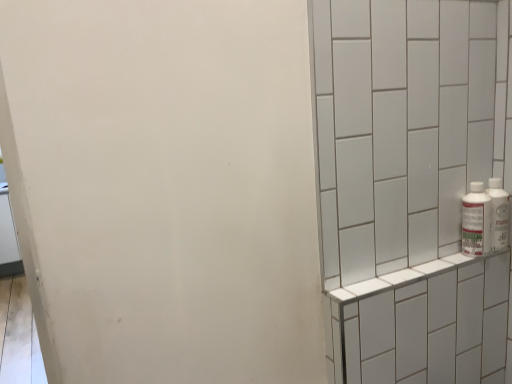
Question: Is white plastic bottle at right, the 2th bottle from the right, at the right side of white tile shelf at right?

Choices:
 (A) yes
 (B) no

Answer: (A)

Question: From a real-world perspective, is white plastic bottle at right, the first bottle from the left, physically above white tile shelf at right?

Choices:
 (A) no
 (B) yes

Answer: (B)

Question: Can you confirm if white plastic bottle at right, the first bottle from the left, is shorter than white tile shelf at right?

Choices:
 (A) no
 (B) yes

Answer: (B)

Question: Could you tell me if white plastic bottle at right, the first bottle from the left, is facing white tile shelf at right?

Choices:
 (A) yes
 (B) no

Answer: (B)

Question: Is white plastic bottle at right, the 2th bottle from the right, smaller than white tile shelf at right?

Choices:
 (A) no
 (B) yes

Answer: (B)

Question: From a real-world perspective, is white tile shelf at right positioned above or below white plastic bottle at right, the first bottle from the left?

Choices:
 (A) below
 (B) above

Answer: (A)

Question: Relative to white plastic bottle at right, the first bottle from the left, is white tile shelf at right in front or behind?

Choices:
 (A) front
 (B) behind

Answer: (A)

Question: Considering the positions of white tile shelf at right and white plastic bottle at right, the 2th bottle from the right, in the image, is white tile shelf at right bigger or smaller than white plastic bottle at right, the 2th bottle from the right,?

Choices:
 (A) big
 (B) small

Answer: (A)

Question: Considering the positions of white tile shelf at right and white plastic bottle at right, the first bottle from the left, in the image, is white tile shelf at right taller or shorter than white plastic bottle at right, the first bottle from the left,?

Choices:
 (A) short
 (B) tall

Answer: (B)

Question: Considering the positions of white tile shelf at right and white plastic bottles at right, which is counted as the second bottle, starting from the left, in the image, is white tile shelf at right taller or shorter than white plastic bottles at right, which is counted as the second bottle, starting from the left,?

Choices:
 (A) tall
 (B) short

Answer: (A)

Question: Considering their positions, is white tile shelf at right located in front of or behind white plastic bottles at right, the 1th bottle in the right-to-left sequence?

Choices:
 (A) behind
 (B) front

Answer: (B)

Question: Considering the positions of white tile shelf at right and white plastic bottles at right, which is counted as the second bottle, starting from the left, in the image, is white tile shelf at right wider or thinner than white plastic bottles at right, which is counted as the second bottle, starting from the left,?

Choices:
 (A) wide
 (B) thin

Answer: (A)

Question: From the image's perspective, relative to white plastic bottles at right, which is counted as the second bottle, starting from the left, is white tile shelf at right above or below?

Choices:
 (A) above
 (B) below

Answer: (B)

Question: Visually, is white plastic bottle at right, the first bottle from the left, positioned to the left or to the right of white tile shelf at right?

Choices:
 (A) left
 (B) right

Answer: (B)

Question: Based on their sizes in the image, would you say white plastic bottle at right, the 2th bottle from the right, is bigger or smaller than white tile shelf at right?

Choices:
 (A) big
 (B) small

Answer: (B)